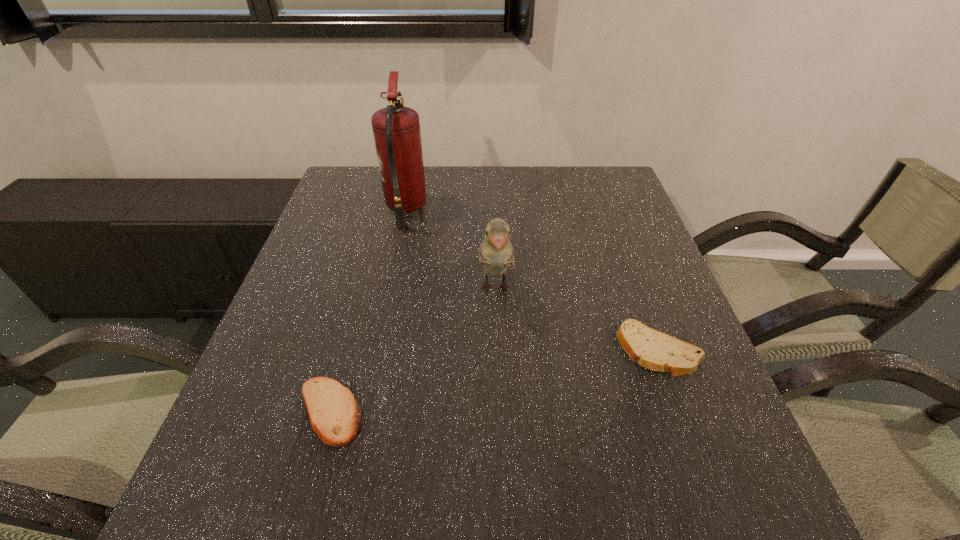
What are the coordinates of `the farthest object` in the screenshot? It's located at (396, 129).

Locate an element on the screen. This screenshot has height=540, width=960. fire extinguisher is located at coordinates (396, 129).

Locate an element on the screen. the third nearest object is located at coordinates (496, 253).

This screenshot has width=960, height=540. Identify the location of bird. (496, 253).

Locate an element on the screen. the nearest object is located at coordinates (334, 414).

You are a GUI agent. You are given a task and a screenshot of the screen. Output one action in this format:
    pyautogui.click(x=<x>, y=<y>)
    Task: Click on the nearer pita bread
    This screenshot has width=960, height=540.
    Given the screenshot: What is the action you would take?
    pyautogui.click(x=334, y=414)

Where is `the right pita bread`? The height and width of the screenshot is (540, 960). the right pita bread is located at coordinates (654, 350).

Locate an element on the screen. the farther pita bread is located at coordinates (654, 350).

I want to click on vacant space located at the front of the tallest object where the nozzle is aimed, so click(492, 209).

What are the coordinates of `vacant space situated 0.180m at the face of the second object from right to left` in the screenshot? It's located at (499, 387).